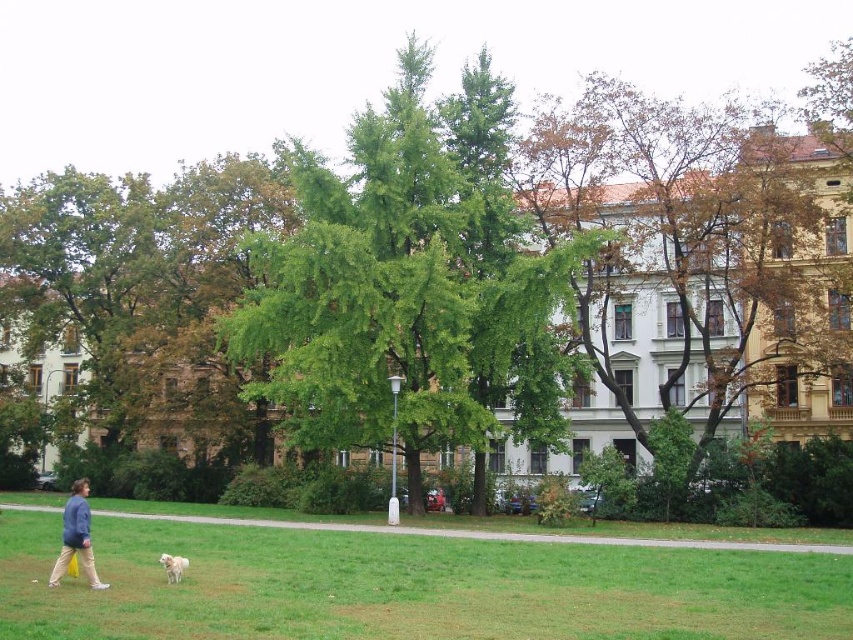
Question: Estimate the real-world distances between objects in this image. Which object is farther from the green grass at lower left?

Choices:
 (A) green leafy tree at center
 (B) brown textured tree at upper right
 (C) white fluffy dog at lower left

Answer: (B)

Question: Which object is farther from the camera taking this photo?

Choices:
 (A) green grass at lower left
 (B) green leafy tree at center
 (C) white fluffy dog at lower left
 (D) blue denim jacket at lower left

Answer: (B)

Question: Can you confirm if green grass at lower left is positioned below white fluffy dog at lower left?

Choices:
 (A) no
 (B) yes

Answer: (B)

Question: In this image, where is green leafy tree at center located relative to brown textured tree at upper right?

Choices:
 (A) left
 (B) right

Answer: (A)

Question: Which point is closer to the camera?

Choices:
 (A) (819, 280)
 (B) (303, 282)
 (C) (28, 532)
 (D) (164, 561)

Answer: (D)

Question: Is green leafy tree at center positioned at the back of green grass at lower left?

Choices:
 (A) no
 (B) yes

Answer: (B)